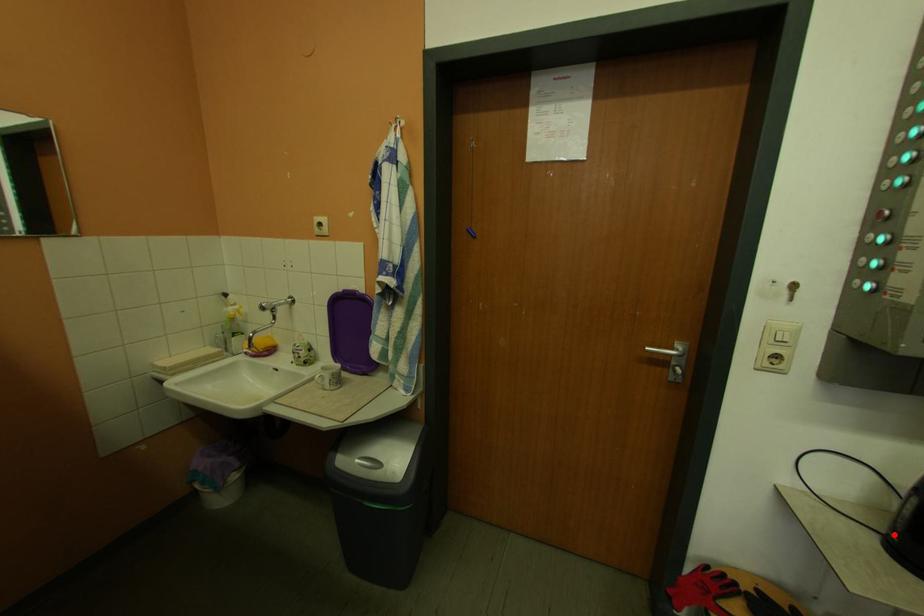
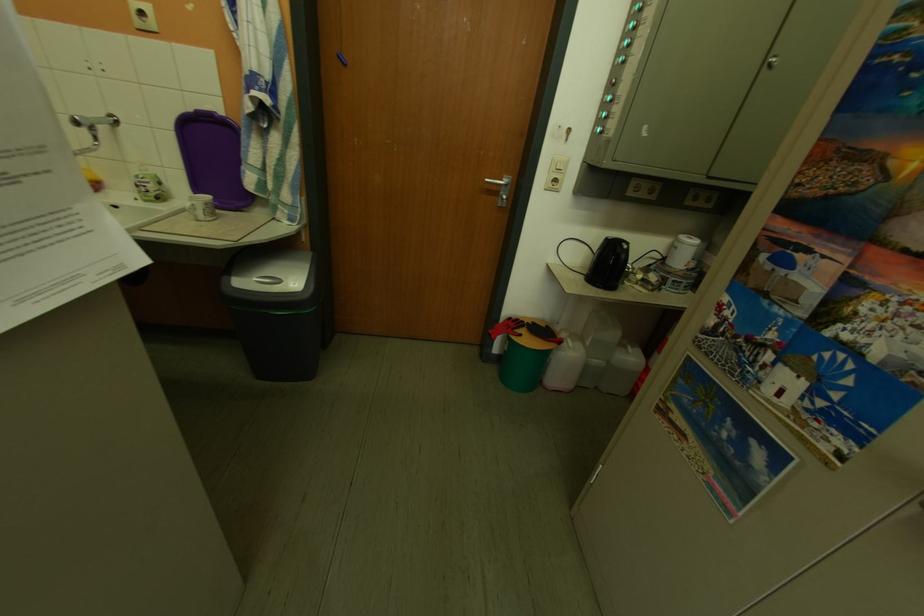
Question: I am providing you with two images of the same scene from different viewpoints. Given a red point in image1, look at the same physical point in image2. Is it:

Choices:
 (A) Closer to the viewpoint
 (B) Farther from the viewpoint

Answer: (B)